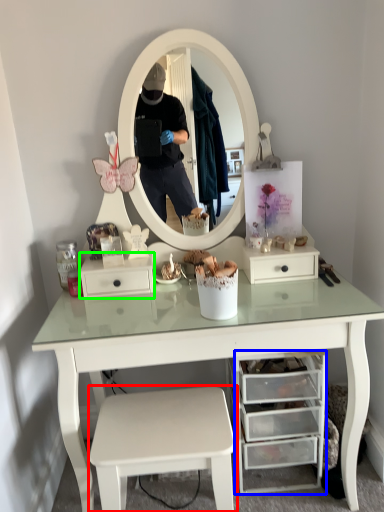
Question: Which object is positioned closest to stool (highlighted by a red box)? Select from drawer (highlighted by a blue box) and drawer (highlighted by a green box).

Choices:
 (A) drawer
 (B) drawer

Answer: (A)